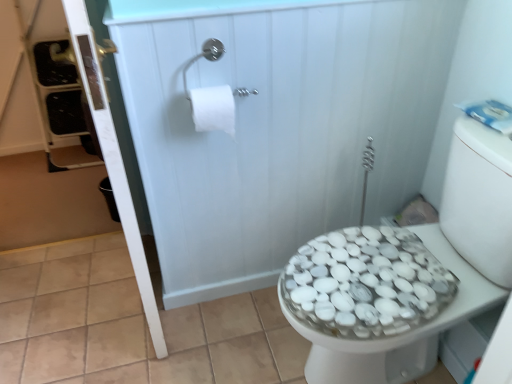
Describe the element at coordinates (402, 333) in the screenshot. The width and height of the screenshot is (512, 384). I see `white pebble-patterned bidet at right` at that location.

Find the location of a particular element. The width and height of the screenshot is (512, 384). white glossy shower door at upper left is located at coordinates (276, 124).

Is white pebble-patterned bidet at right far away from white glossy shower door at upper left?

That's not correct — white pebble-patterned bidet at right is a little close to white glossy shower door at upper left.

From a real-world perspective, is white pebble-patterned bidet at right below white glossy shower door at upper left?

Indeed, from a real-world perspective, white pebble-patterned bidet at right is positioned beneath white glossy shower door at upper left.

Is white glossy shower door at upper left at the back of white pebble-patterned bidet at right?

No, white pebble-patterned bidet at right is not facing away from white glossy shower door at upper left.

Is white glossy shower door at upper left inside white pebble-patterned bidet at right?

No, white glossy shower door at upper left is located outside of white pebble-patterned bidet at right.

Is point (303, 326) more distant than point (207, 107)?

No, it is in front of (207, 107).

Who is bigger, white pebble-patterned bidet at right or white matte toilet paper at upper center?

Bigger between the two is white pebble-patterned bidet at right.

Considering the relative positions of white pebble-patterned bidet at right and white matte toilet paper at upper center in the image provided, is white pebble-patterned bidet at right to the right of white matte toilet paper at upper center from the viewer's perspective?

Correct, you'll find white pebble-patterned bidet at right to the right of white matte toilet paper at upper center.

Which of these two, white pebble-patterned bidet at right or white matte toilet paper at upper center, is wider?

With larger width is white pebble-patterned bidet at right.

Based on the photo, who is smaller, white matte toilet paper at upper center or white pebble-patterned bidet at right?

With smaller size is white matte toilet paper at upper center.

How different are the orientations of white matte toilet paper at upper center and white pebble-patterned bidet at right in degrees?

The facing directions of white matte toilet paper at upper center and white pebble-patterned bidet at right are 90.1 degrees apart.

From the image's perspective, relative to white pebble-patterned bidet at right, is white matte toilet paper at upper center above or below?

white matte toilet paper at upper center is situated higher than white pebble-patterned bidet at right in the image.

Is white matte toilet paper at upper center at the right side of white pebble-patterned bidet at right?

Incorrect, white matte toilet paper at upper center is not on the right side of white pebble-patterned bidet at right.

In terms of width, does white matte toilet paper at upper center look wider or thinner when compared to white glossy shower door at upper left?

white matte toilet paper at upper center is wider than white glossy shower door at upper left.

Consider the image. Which is further, [199,107] or [192,44]?

The point [199,107] is behind.

From a real-world perspective, is white matte toilet paper at upper center physically located above or below white glossy shower door at upper left?

Clearly, from a real-world perspective, white matte toilet paper at upper center is above white glossy shower door at upper left.

Who is smaller, white matte toilet paper at upper center or white glossy shower door at upper left?

With smaller size is white matte toilet paper at upper center.

Which of these two, white glossy shower door at upper left or white pebble-patterned bidet at right, is wider?

Wider between the two is white pebble-patterned bidet at right.

Is white glossy shower door at upper left positioned in front of white pebble-patterned bidet at right?

That is False.

The image size is (512, 384). What are the coordinates of `bidet below the white glossy shower door at upper left (from the image's perspective)` in the screenshot? It's located at (402, 333).

Is the surface of white glossy shower door at upper left in direct contact with white pebble-patterned bidet at right?

No, white glossy shower door at upper left is not touching white pebble-patterned bidet at right.

From a real-world perspective, is white glossy shower door at upper left positioned over white matte toilet paper at upper center based on gravity?

No.

From the image's perspective, is white glossy shower door at upper left below white matte toilet paper at upper center?

Yes, from the image's perspective, white glossy shower door at upper left is beneath white matte toilet paper at upper center.

Does white glossy shower door at upper left have a greater height compared to white matte toilet paper at upper center?

Yes, white glossy shower door at upper left is taller than white matte toilet paper at upper center.

Considering the sizes of objects white glossy shower door at upper left and white matte toilet paper at upper center in the image provided, who is thinner, white glossy shower door at upper left or white matte toilet paper at upper center?

white glossy shower door at upper left.

Locate an element on the screen. screen door above the white pebble-patterned bidet at right (from the image's perspective) is located at coordinates (276, 124).

This screenshot has height=384, width=512. I want to click on bidet located on the right of white matte toilet paper at upper center, so click(402, 333).

When comparing their distances from white matte toilet paper at upper center, does white glossy shower door at upper left or white pebble-patterned bidet at right seem closer?

Among the two, white glossy shower door at upper left is located nearer to white matte toilet paper at upper center.

Estimate the real-world distances between objects in this image. Which object is closer to white pebble-patterned bidet at right, white matte toilet paper at upper center or white glossy shower door at upper left?

Among the two, white glossy shower door at upper left is located nearer to white pebble-patterned bidet at right.

From the image, which object appears to be nearer to white glossy shower door at upper left, white matte toilet paper at upper center or white pebble-patterned bidet at right?

Based on the image, white matte toilet paper at upper center appears to be nearer to white glossy shower door at upper left.

Estimate the real-world distances between objects in this image. Which object is further from white matte toilet paper at upper center, white pebble-patterned bidet at right or white glossy shower door at upper left?

white pebble-patterned bidet at right.

Based on their spatial positions, is white glossy shower door at upper left or white matte toilet paper at upper center further from white pebble-patterned bidet at right?

white matte toilet paper at upper center is further to white pebble-patterned bidet at right.

Which object lies further to the anchor point white glossy shower door at upper left, white pebble-patterned bidet at right or white matte toilet paper at upper center?

The object further to white glossy shower door at upper left is white pebble-patterned bidet at right.

Locate an element on the screen. This screenshot has width=512, height=384. screen door between white matte toilet paper at upper center and white pebble-patterned bidet at right from left to right is located at coordinates (276, 124).